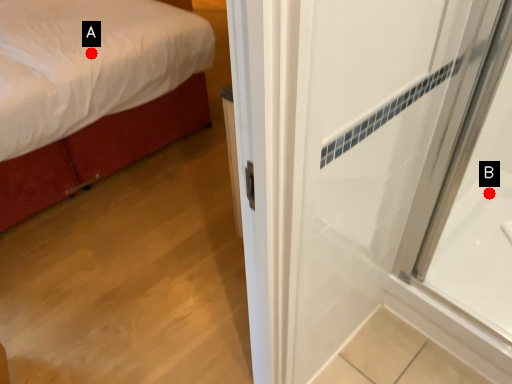
Question: Two points are circled on the image, labeled by A and B beside each circle. Among these points, which one is farthest from the camera?

Choices:
 (A) A is further
 (B) B is further

Answer: (A)